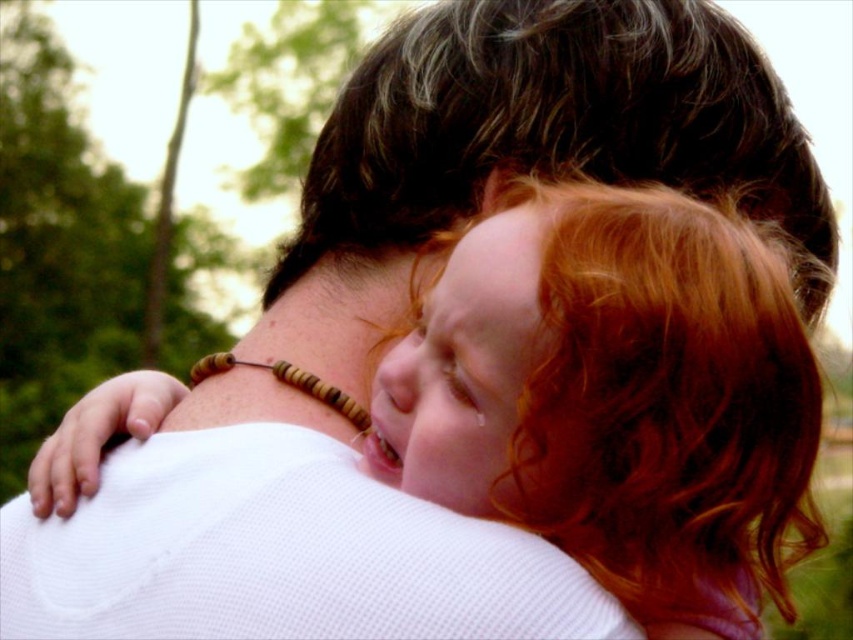
In the scene shown: Based on the scene described, which hair is positioned lower between the curly red hair at upper right and the dark brown wavy hair at upper center?

The curly red hair at upper right is positioned lower than the dark brown wavy hair at upper center.